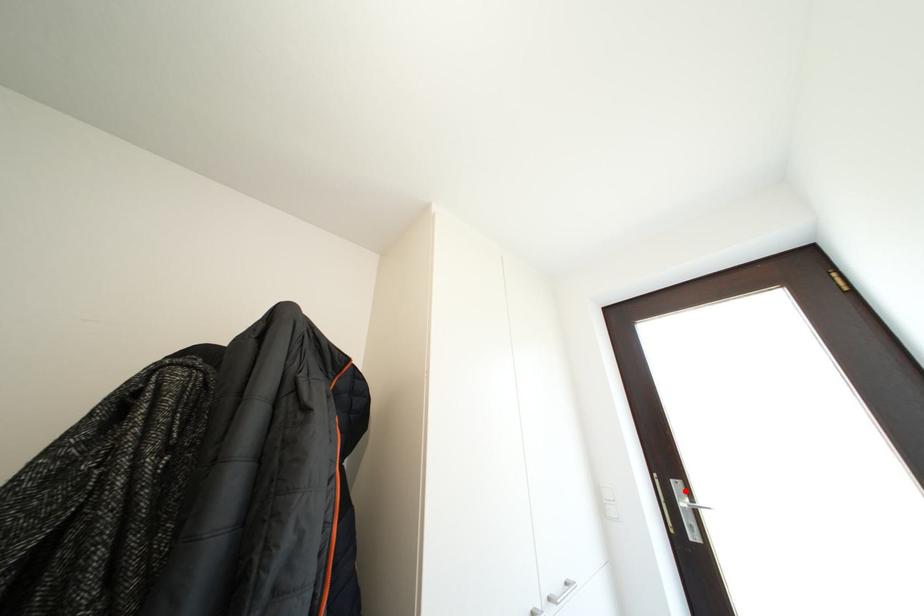
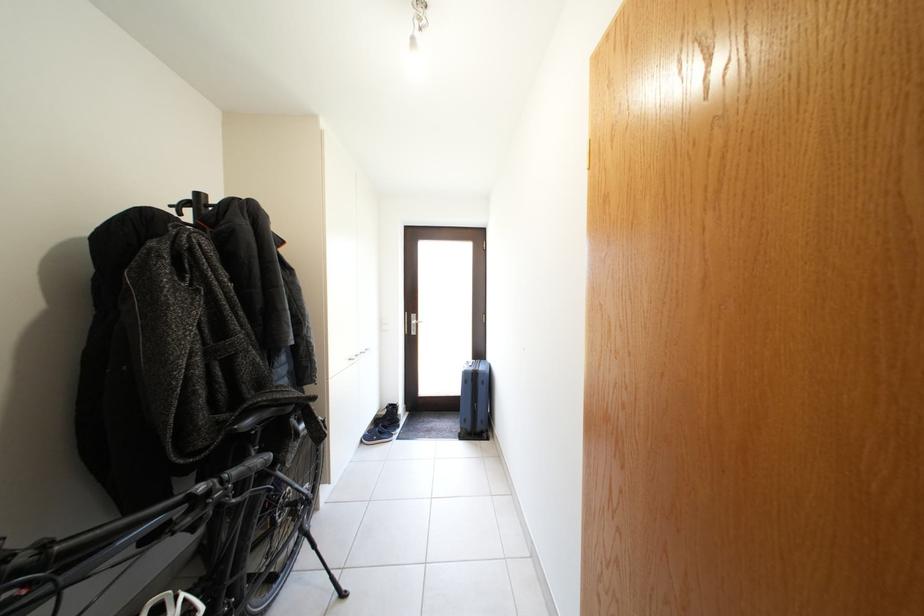
In the second image, find the point that corresponds to the highlighted location in the first image.

(421, 322)